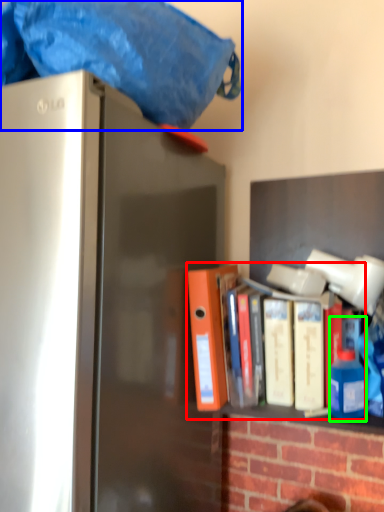
Question: Which object is the closest to the book (highlighted by a red box)? Choose among these: blanket (highlighted by a blue box) or bottle (highlighted by a green box).

Choices:
 (A) blanket
 (B) bottle

Answer: (B)